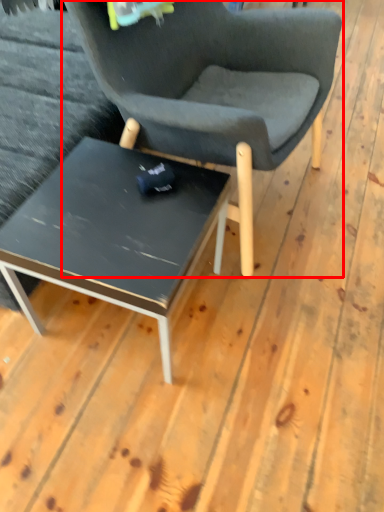
Question: From the image's perspective, where is chair (annotated by the red box) located relative to coffee table?

Choices:
 (A) below
 (B) above

Answer: (B)